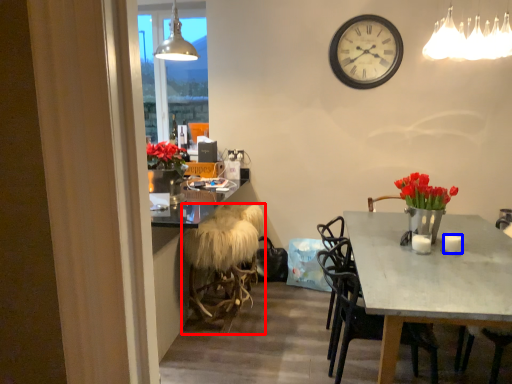
Question: Which of the following is the closest to the observer, stool (highlighted by a red box) or coffee cup (highlighted by a blue box)?

Choices:
 (A) stool
 (B) coffee cup

Answer: (B)